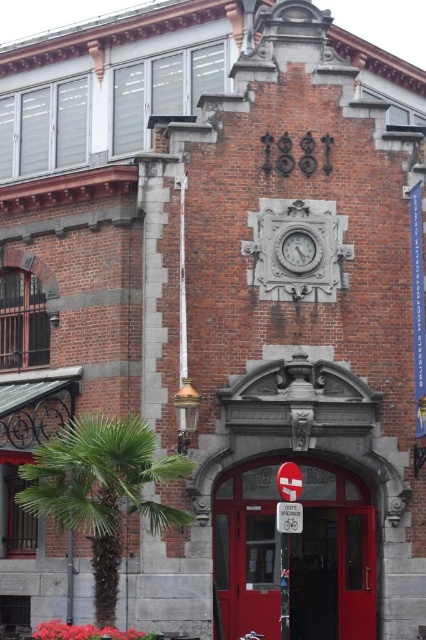
Question: Which of these objects is positioned farthest from the green leafy palm tree at left?

Choices:
 (A) smooth red door at center
 (B) white stone clock at center

Answer: (B)

Question: Which object is positioned closest to the smooth red door at center?

Choices:
 (A) metallic reflective sign at center
 (B) green leafy palm tree at left
 (C) white stone clock at center
 (D) red plastic sign at center

Answer: (C)

Question: Does smooth red door at center have a lesser width compared to white stone clock at center?

Choices:
 (A) yes
 (B) no

Answer: (A)

Question: Among these points, which one is farthest from the camera?

Choices:
 (A) (299, 513)
 (B) (71, 476)

Answer: (A)

Question: Can you confirm if smooth red door at center is bigger than white stone clock at center?

Choices:
 (A) no
 (B) yes

Answer: (A)

Question: Is green leafy palm tree at left to the right of red plastic sign at center from the viewer's perspective?

Choices:
 (A) no
 (B) yes

Answer: (A)